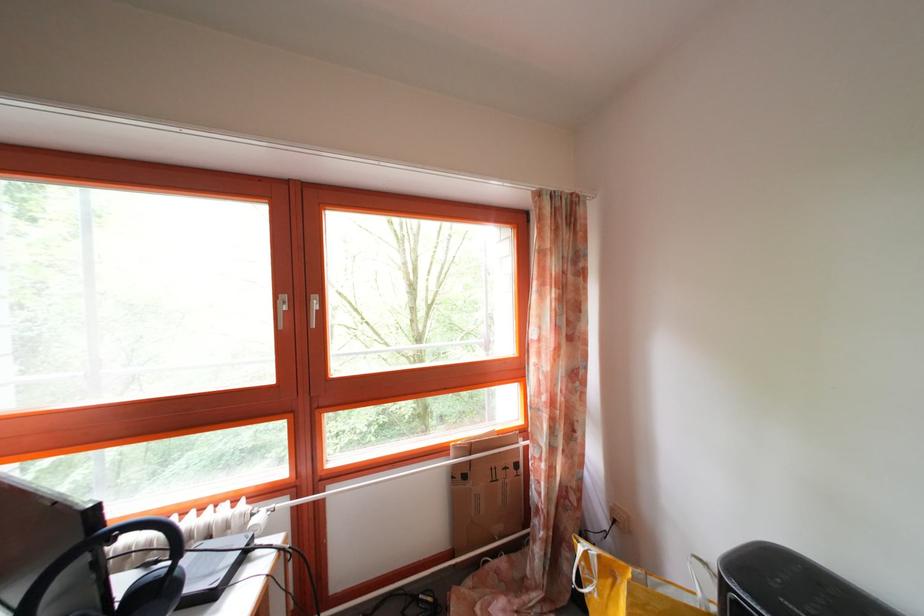
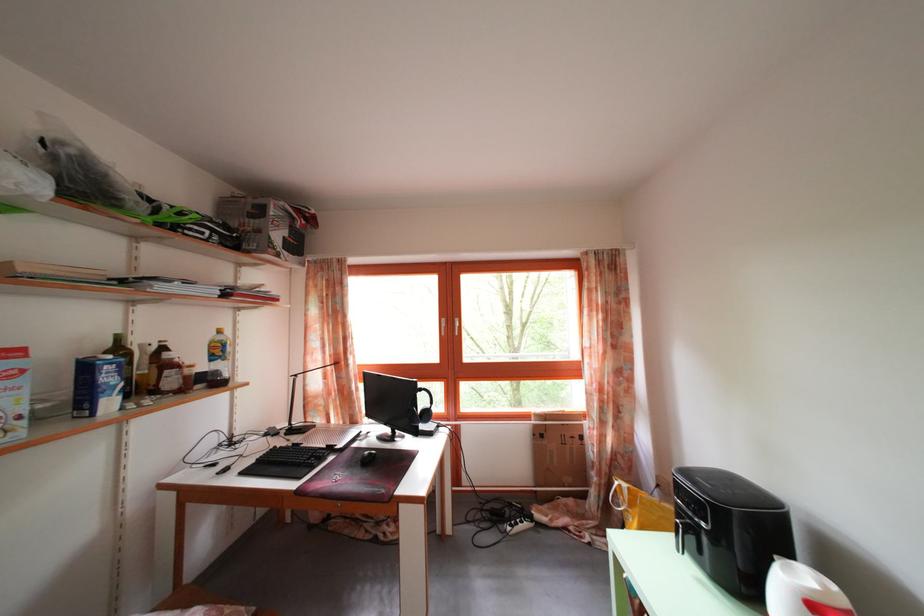
Question: The first image is from the beginning of the video and the second image is from the end. How did the camera likely rotate when shooting the video?

Choices:
 (A) Left
 (B) Right
 (C) Up
 (D) Down

Answer: (A)